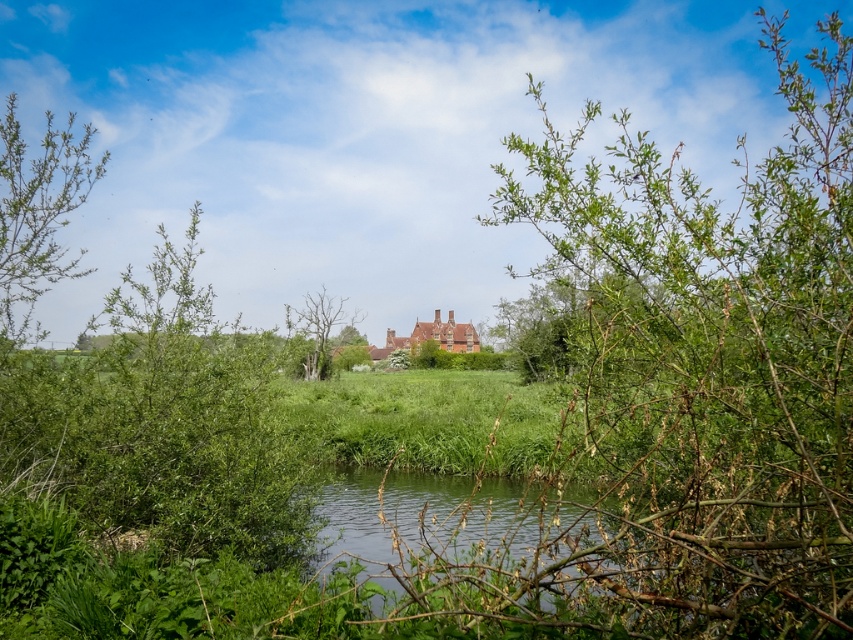
Question: Which object is farther from the camera taking this photo?

Choices:
 (A) bare wood tree at center
 (B) green leafy bush at left

Answer: (A)

Question: Is green leafy bush at left to the left of bare wood tree at center from the viewer's perspective?

Choices:
 (A) no
 (B) yes

Answer: (A)

Question: Can you confirm if green leafy bush at left is thinner than bare wood tree at center?

Choices:
 (A) yes
 (B) no

Answer: (A)

Question: Which point is farther from the camera taking this photo?

Choices:
 (A) (28, 324)
 (B) (329, 364)

Answer: (B)

Question: Does green leafy bush at left appear over bare wood tree at center?

Choices:
 (A) yes
 (B) no

Answer: (A)